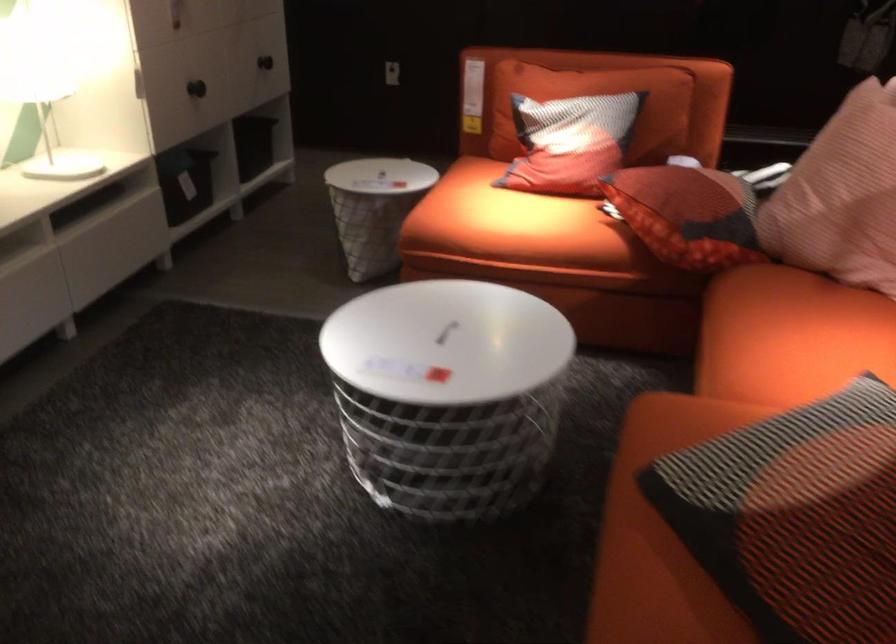
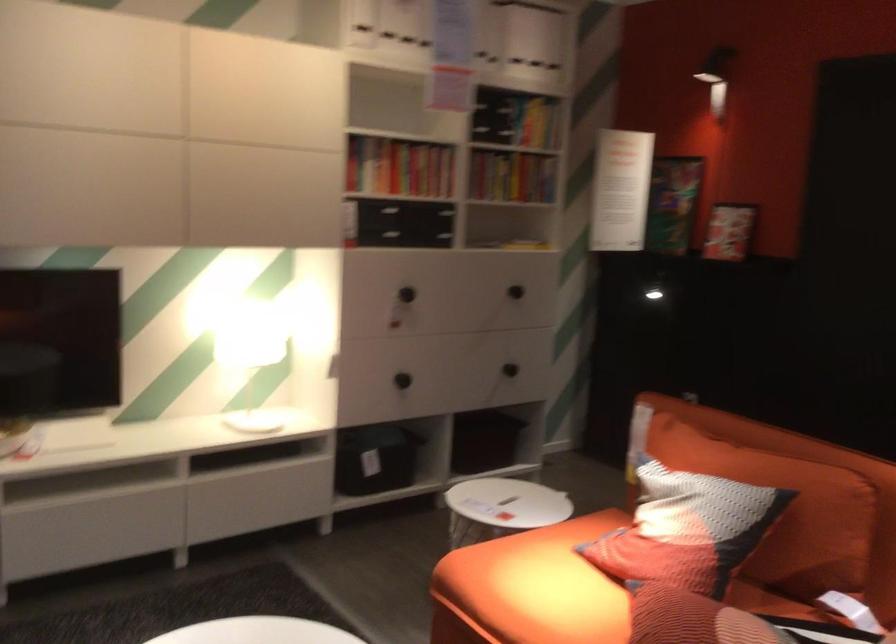
Find the pixel in the second image that matches point 655,104 in the first image.

(785, 511)